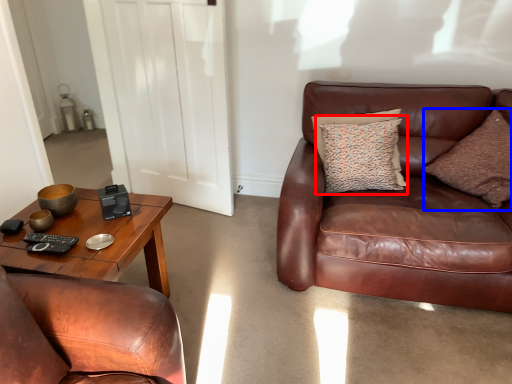
Question: Which object is closer to the camera taking this photo, pillow (highlighted by a red box) or pillow (highlighted by a blue box)?

Choices:
 (A) pillow
 (B) pillow

Answer: (B)